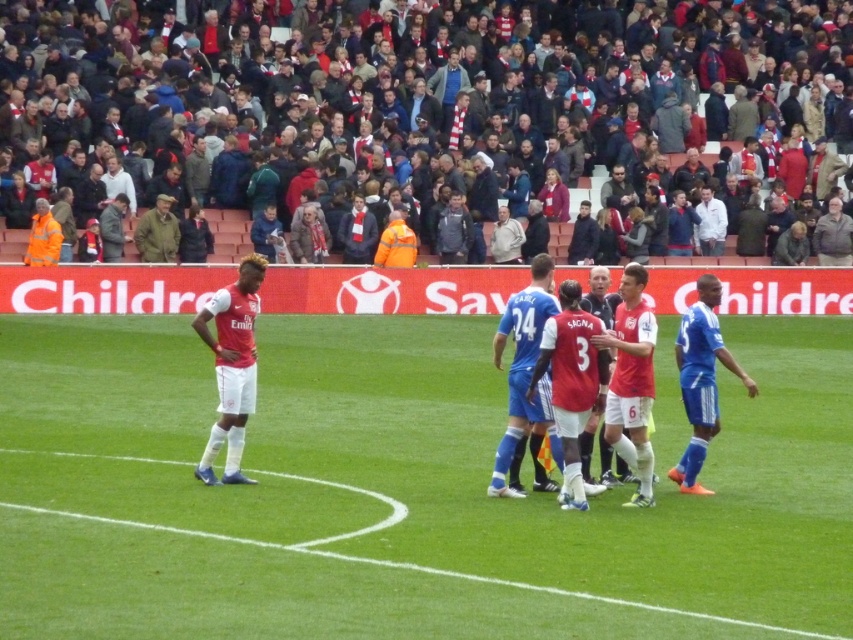
Does green grass field at center appear on the right side of matte red jersey at left?

Correct, you'll find green grass field at center to the right of matte red jersey at left.

Is the position of green grass field at center less distant than that of matte red jersey at left?

Yes.

What do you see at coordinates (399, 492) in the screenshot?
I see `green grass field at center` at bounding box center [399, 492].

Where is `green grass field at center`? green grass field at center is located at coordinates (399, 492).

Does blue jersey at center appear on the left side of red jersey at center?

Correct, you'll find blue jersey at center to the left of red jersey at center.

Can you confirm if blue jersey at center is positioned below red jersey at center?

Yes.

I want to click on blue jersey at center, so click(x=523, y=368).

Where is `blue jersey at center`? The height and width of the screenshot is (640, 853). blue jersey at center is located at coordinates (523, 368).

This screenshot has width=853, height=640. Identify the location of red jersey at center. (599, 452).

Is point (614, 301) positioned before point (143, 237)?

Yes.

I want to click on red jersey at center, so click(x=599, y=452).